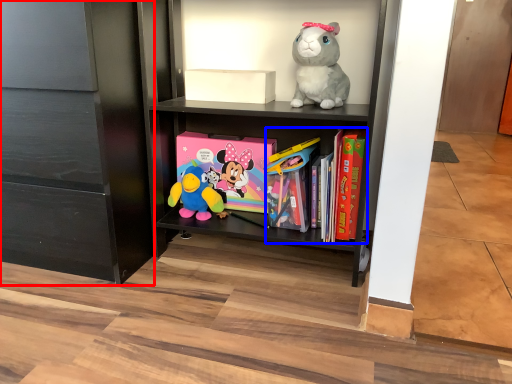
Question: Which point is closer to the camera, cabinetry (highlighted by a red box) or book (highlighted by a blue box)?

Choices:
 (A) cabinetry
 (B) book

Answer: (A)